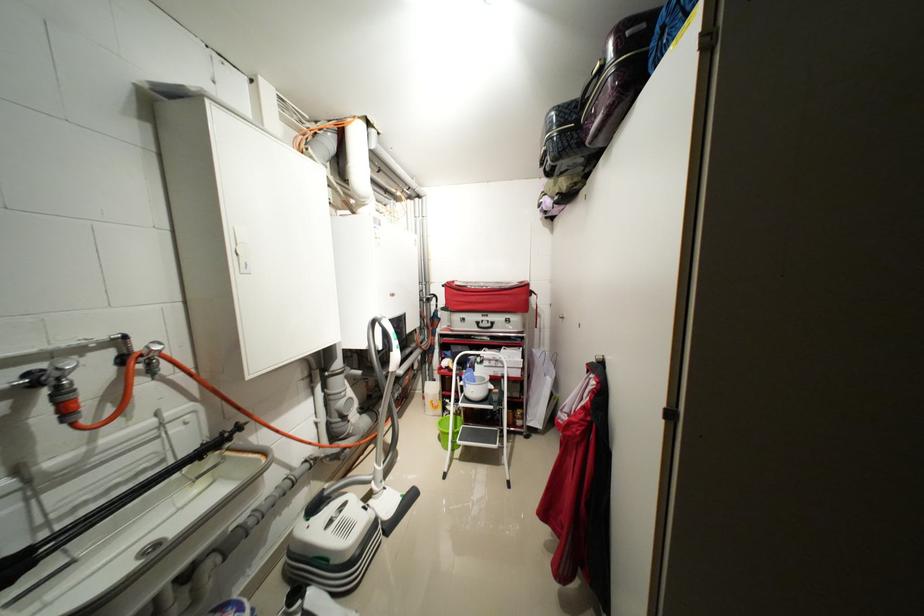
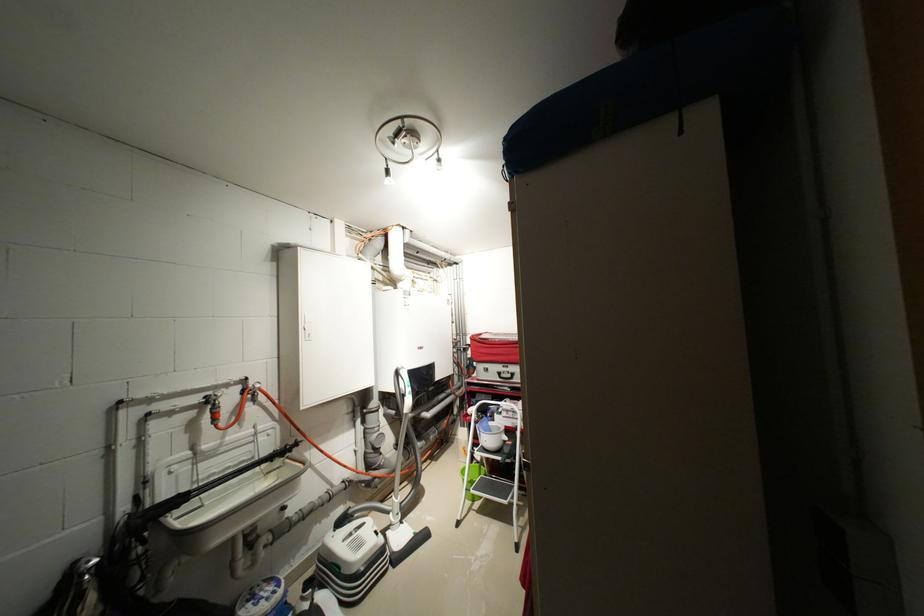
In the second image, find the point that corresponds to (496,361) in the first image.

(515, 411)